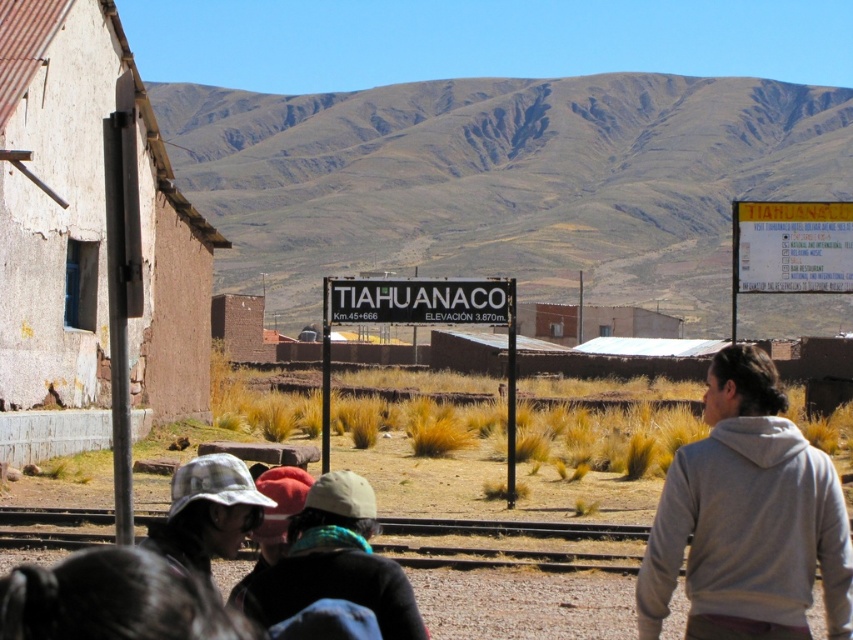
Which is behind, point (328, 339) or point (256, 499)?

Positioned behind is point (328, 339).

Is white plastic sign at center thinner than plaid fabric hat at lower left?

In fact, white plastic sign at center might be wider than plaid fabric hat at lower left.

Image resolution: width=853 pixels, height=640 pixels. Identify the location of white plastic sign at center. (421, 323).

Is dark gray knit cap at center wider than plaid fabric hat at lower left?

Incorrect, dark gray knit cap at center's width does not surpass plaid fabric hat at lower left's.

This screenshot has width=853, height=640. Identify the location of dark gray knit cap at center. (335, 563).

Between dark gray knit cap at center and white plastic sign at center, which one is positioned lower?

white plastic sign at center

Does point (357, 566) lie behind point (508, 454)?

No, it is not.

What do you see at coordinates (335, 563) in the screenshot?
I see `dark gray knit cap at center` at bounding box center [335, 563].

At what (x,y) coordinates should I click in order to perform the action: click on dark gray knit cap at center. Please return your answer as a coordinate pair (x, y). The width and height of the screenshot is (853, 640). Looking at the image, I should click on (335, 563).